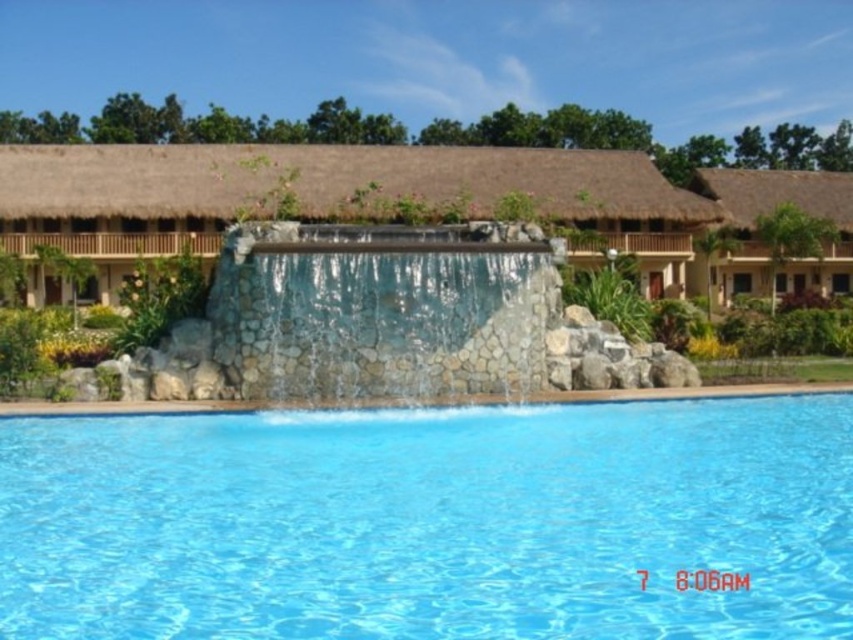
Question: Based on their relative distances, which object is farther from the brown thatch hut at center?

Choices:
 (A) clear blue water at center
 (B) thatched roof hut at upper right

Answer: (A)

Question: Is clear blue water at center above thatched roof hut at upper right?

Choices:
 (A) yes
 (B) no

Answer: (B)

Question: Is translucent stone waterfall at center below thatched roof hut at upper right?

Choices:
 (A) no
 (B) yes

Answer: (B)

Question: Which object is positioned farthest from the translucent stone waterfall at center?

Choices:
 (A) thatched roof hut at upper right
 (B) brown thatch hut at center
 (C) clear blue water at center

Answer: (A)

Question: Which point appears farthest from the camera in this image?

Choices:
 (A) (48, 616)
 (B) (703, 212)
 (C) (767, 211)

Answer: (C)

Question: Is clear blue water at center above brown thatch hut at center?

Choices:
 (A) no
 (B) yes

Answer: (A)